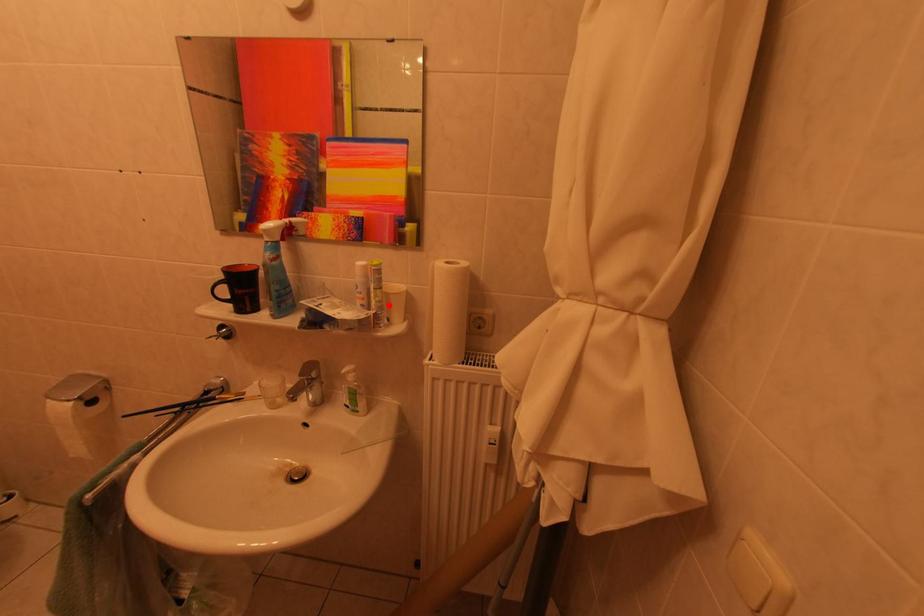
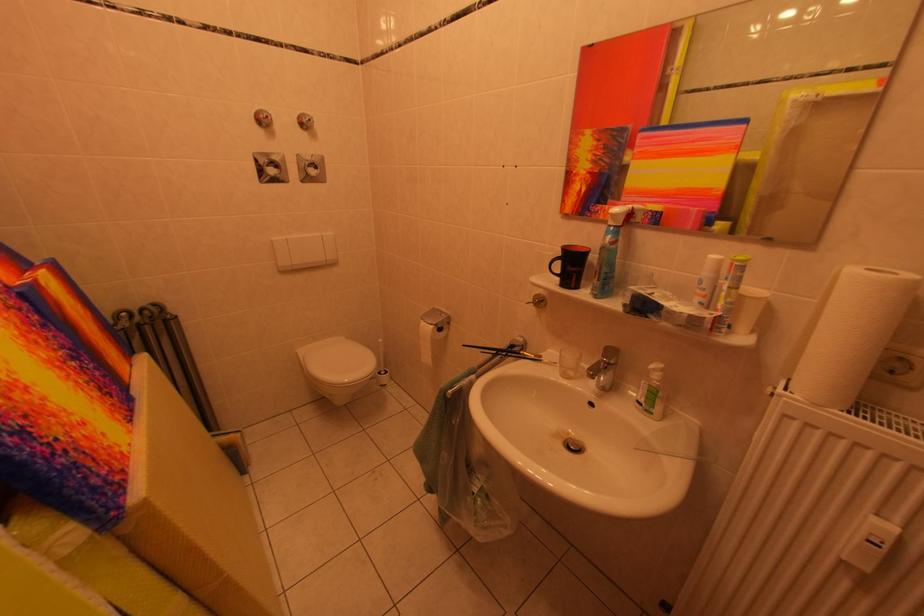
In the second image, find the point that corresponds to the highlighted location in the first image.

(739, 307)